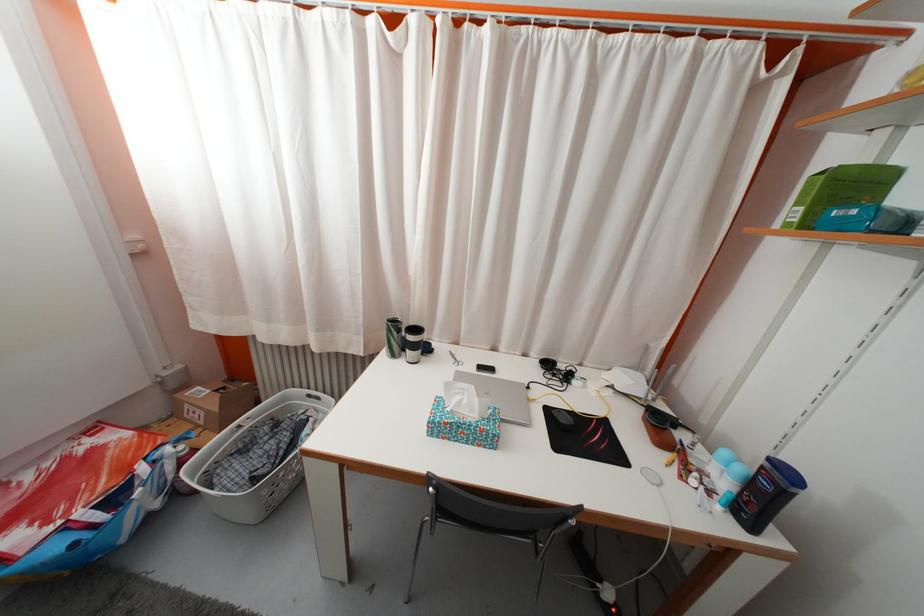
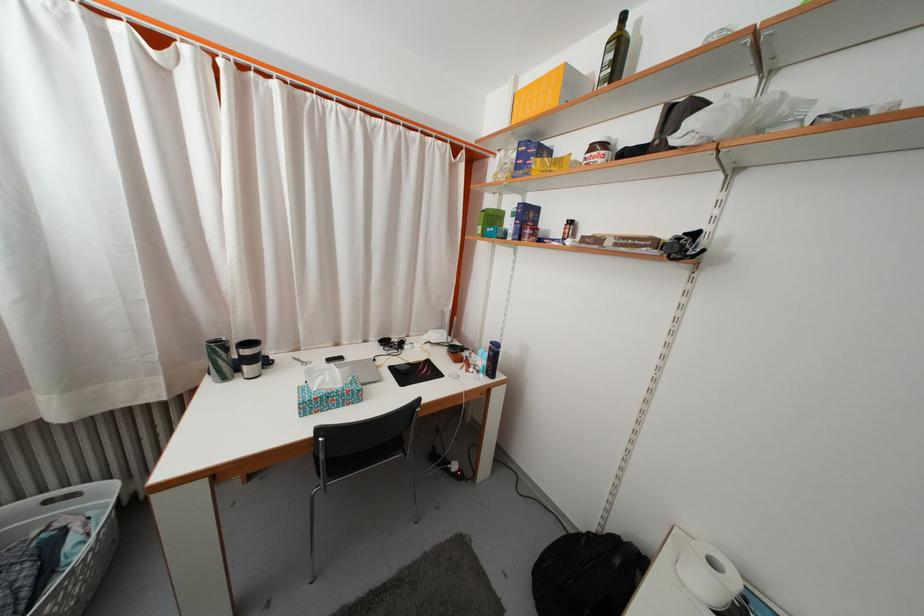
Find the pixel in the second image that matches the point at 459,355 in the first image.

(301, 362)